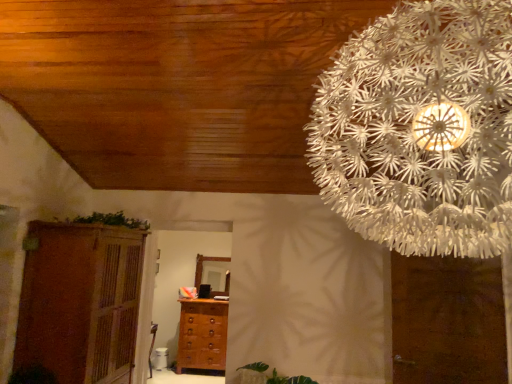
What do you see at coordinates (421, 129) in the screenshot?
I see `white paper flower at upper right` at bounding box center [421, 129].

This screenshot has width=512, height=384. Find the location of `brown wooden chest of drawers at center`. brown wooden chest of drawers at center is located at coordinates (202, 335).

Is brown matte door at upper right next to brown wooden chest of drawers at center and touching it?

No, brown matte door at upper right is not next to brown wooden chest of drawers at center.

From the image's perspective, is brown matte door at upper right below brown wooden chest of drawers at center?

No, from the image's perspective, brown matte door at upper right is not below brown wooden chest of drawers at center.

From a real-world perspective, is brown matte door at upper right below brown wooden chest of drawers at center?

No, from a real-world perspective, brown matte door at upper right is not beneath brown wooden chest of drawers at center.

Are brown wooden chest of drawers at center and white paper flower at upper right making contact?

They are not placed beside each other.

Is brown wooden chest of drawers at center facing away from white paper flower at upper right?

No, brown wooden chest of drawers at center is not facing the opposite direction of white paper flower at upper right.

How different are the orientations of brown wooden chest of drawers at center and white paper flower at upper right in degrees?

The facing directions of brown wooden chest of drawers at center and white paper flower at upper right are 179 degrees apart.

From the image's perspective, does brown wooden chest of drawers at center appear lower than white paper flower at upper right?

Yes.

Which of these two, brown wooden cupboard at left or green leafy plant at upper left, stands shorter?

green leafy plant at upper left is shorter.

Does brown wooden cupboard at left turn towards green leafy plant at upper left?

No, brown wooden cupboard at left is not oriented towards green leafy plant at upper left.

Considering the sizes of brown wooden cupboard at left and green leafy plant at upper left in the image, is brown wooden cupboard at left wider or thinner than green leafy plant at upper left?

brown wooden cupboard at left is wider than green leafy plant at upper left.

Is there a large distance between green leafy plant at upper left and brown matte door at upper right?

green leafy plant at upper left is far away from brown matte door at upper right.

Based on the photo, is green leafy plant at upper left to the right of brown matte door at upper right from the viewer's perspective?

In fact, green leafy plant at upper left is to the left of brown matte door at upper right.

You are a GUI agent. You are given a task and a screenshot of the screen. Output one action in this format:
    pyautogui.click(x=<x>, y=<y>)
    Task: Click on the door located on the right of green leafy plant at upper left
    
    Given the screenshot: What is the action you would take?
    pyautogui.click(x=447, y=321)

Does green leafy plant at upper left have a lesser width compared to brown matte door at upper right?

No.

Is green leafy plant at upper left wider or thinner than brown wooden chest of drawers at center?

Clearly, green leafy plant at upper left has more width compared to brown wooden chest of drawers at center.

From a real-world perspective, which object stands above the other?

In real-world perspective, green leafy plant at upper left is above.

Who is more distant, green leafy plant at upper left or brown wooden chest of drawers at center?

brown wooden chest of drawers at center is more distant.

How different are the orientations of green leafy plant at upper left and brown wooden chest of drawers at center in degrees?

The angle between the facing direction of green leafy plant at upper left and the facing direction of brown wooden chest of drawers at center is 91.5 degrees.

Who is shorter, green leafy plant at upper left or brown wooden cupboard at left?

With less height is green leafy plant at upper left.

Is green leafy plant at upper left positioned with its back to brown wooden cupboard at left?

green leafy plant at upper left does not have its back to brown wooden cupboard at left.

From the image's perspective, which object appears higher, green leafy plant at upper left or brown wooden cupboard at left?

green leafy plant at upper left is shown above in the image.

Image resolution: width=512 pixels, height=384 pixels. In the image, there is a brown matte door at upper right. In order to click on cupboard below it (from the image's perspective) in this screenshot , I will do `click(80, 301)`.

Between brown wooden cupboard at left and brown matte door at upper right, which one appears on the right side from the viewer's perspective?

Positioned to the right is brown matte door at upper right.

Could brown matte door at upper right be considered to be inside brown wooden cupboard at left?

Actually, brown matte door at upper right is outside brown wooden cupboard at left.

Considering the points (94, 256) and (426, 315), which point is in front, point (94, 256) or point (426, 315)?

The point (426, 315) is more forward.

This screenshot has width=512, height=384. I want to click on chest of drawers lying on the left of brown matte door at upper right, so click(x=202, y=335).

You are a GUI agent. You are given a task and a screenshot of the screen. Output one action in this format:
    pyautogui.click(x=<x>, y=<y>)
    Task: Click on the flower above the brown wooden chest of drawers at center (from the image's perspective)
    The width and height of the screenshot is (512, 384).
    Given the screenshot: What is the action you would take?
    pyautogui.click(x=421, y=129)

From the image, which object appears to be farther from white paper flower at upper right, brown matte door at upper right or brown wooden chest of drawers at center?

brown wooden chest of drawers at center.

Which object lies further to the anchor point brown matte door at upper right, brown wooden chest of drawers at center or white paper flower at upper right?

brown wooden chest of drawers at center is positioned further to the anchor brown matte door at upper right.

Looking at the image, which one is located closer to brown matte door at upper right, brown wooden cupboard at left or white paper flower at upper right?

white paper flower at upper right.

Looking at the image, which one is located further to green leafy plant at upper left, brown wooden chest of drawers at center or brown matte door at upper right?

Among the two, brown matte door at upper right is located further to green leafy plant at upper left.

From the image, which object appears to be farther from brown matte door at upper right, brown wooden cupboard at left or green leafy plant at upper left?

green leafy plant at upper left is further to brown matte door at upper right.

Estimate the real-world distances between objects in this image. Which object is closer to white paper flower at upper right, brown matte door at upper right or green leafy plant at upper left?

brown matte door at upper right.

Estimate the real-world distances between objects in this image. Which object is further from brown wooden cupboard at left, white paper flower at upper right or green leafy plant at upper left?

The object further to brown wooden cupboard at left is white paper flower at upper right.

Based on their spatial positions, is green leafy plant at upper left or white paper flower at upper right closer to brown wooden chest of drawers at center?

Based on the image, green leafy plant at upper left appears to be nearer to brown wooden chest of drawers at center.

This screenshot has height=384, width=512. Find the location of `door between white paper flower at upper right and brown wooden chest of drawers at center along the z-axis`. door between white paper flower at upper right and brown wooden chest of drawers at center along the z-axis is located at coordinates click(x=447, y=321).

Where is `cupboard between white paper flower at upper right and green leafy plant at upper left in the front-back direction`? The image size is (512, 384). cupboard between white paper flower at upper right and green leafy plant at upper left in the front-back direction is located at coordinates (80, 301).

You are a GUI agent. You are given a task and a screenshot of the screen. Output one action in this format:
    pyautogui.click(x=<x>, y=<y>)
    Task: Click on the cupboard located between brown matte door at upper right and brown wooden chest of drawers at center in the depth direction
    This screenshot has height=384, width=512.
    Given the screenshot: What is the action you would take?
    pyautogui.click(x=80, y=301)

Identify the location of plant between brown wooden cupboard at left and brown matte door at upper right in the horizontal direction. (112, 220).